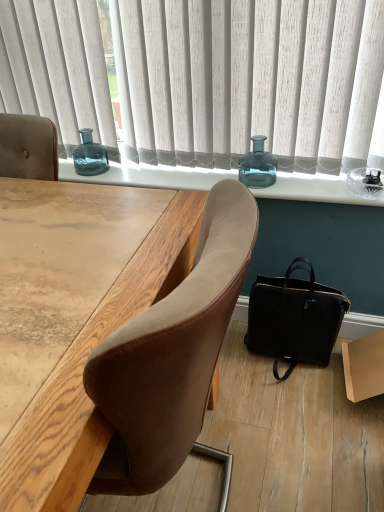
The width and height of the screenshot is (384, 512). I want to click on transparent glass vase at upper center, which is the 1th bottle from front to back, so (258, 165).

Between black leather handbag at lower right and wooden desk at center, which one appears on the right side from the viewer's perspective?

black leather handbag at lower right.

In the scene shown: Is black leather handbag at lower right located outside wooden desk at center?

Absolutely, black leather handbag at lower right is external to wooden desk at center.

Which of these two, black leather handbag at lower right or wooden desk at center, stands taller?

wooden desk at center is taller.

Is black leather handbag at lower right positioned with its back to wooden desk at center?

No, wooden desk at center is not at the back of black leather handbag at lower right.

From the picture: Is teal glass vase at center aimed at brown cardboard box at lower right?

No.

Between teal glass vase at center and brown cardboard box at lower right, which one is positioned in front?

brown cardboard box at lower right is closer to the camera.

From a real-world perspective, is teal glass vase at center physically located above or below brown cardboard box at lower right?

Clearly, from a real-world perspective, teal glass vase at center is above brown cardboard box at lower right.

At what (x,y) coordinates should I click in order to perform the action: click on box located underneath the teal glass vase at center (from a real-world perspective). Please return your answer as a coordinate pair (x, y). Looking at the image, I should click on (364, 366).

Can we say black leather handbag at lower right lies outside teal glass bottle at upper center, the first bottle viewed from the left?

Yes, black leather handbag at lower right is outside of teal glass bottle at upper center, the first bottle viewed from the left.

Which object is thinner, black leather handbag at lower right or teal glass bottle at upper center, arranged as the 2th bottle when viewed from the front?

teal glass bottle at upper center, arranged as the 2th bottle when viewed from the front.

Between black leather handbag at lower right and teal glass bottle at upper center, arranged as the 2th bottle when viewed from the front, which one has less height?

teal glass bottle at upper center, arranged as the 2th bottle when viewed from the front, is shorter.

From a real-world perspective, relative to teal glass bottle at upper center, arranged as the 2th bottle when viewed from the front, is black leather handbag at lower right vertically above or below?

In terms of real-world spatial position, black leather handbag at lower right is below teal glass bottle at upper center, arranged as the 2th bottle when viewed from the front.

From a real-world perspective, who is located lower, white fabric curtain at upper center or teal glass bottle at upper center, which is counted as the first bottle, starting from the back?

teal glass bottle at upper center, which is counted as the first bottle, starting from the back, from a real-world perspective.

Is white fabric curtain at upper center located outside teal glass bottle at upper center, arranged as the 2th bottle when viewed from the front?

Absolutely, white fabric curtain at upper center is external to teal glass bottle at upper center, arranged as the 2th bottle when viewed from the front.

Is white fabric curtain at upper center taller or shorter than teal glass bottle at upper center, the first bottle viewed from the left?

Considering their sizes, white fabric curtain at upper center has more height than teal glass bottle at upper center, the first bottle viewed from the left.

At what (x,y) coordinates should I click in order to perform the action: click on curtain on the left of black leather handbag at lower right. Please return your answer as a coordinate pair (x, y). Looking at the image, I should click on (251, 80).

Is black leather handbag at lower right at the back of white fabric curtain at upper center?

No, black leather handbag at lower right is not at the back of white fabric curtain at upper center.

Would you say white fabric curtain at upper center is a long distance from black leather handbag at lower right?

That's not correct — white fabric curtain at upper center is a little close to black leather handbag at lower right.

From a real-world perspective, does white fabric curtain at upper center sit lower than black leather handbag at lower right?

No, from a real-world perspective, white fabric curtain at upper center is not beneath black leather handbag at lower right.

Does point (98, 167) come closer to viewer compared to point (362, 339)?

No, (98, 167) is behind (362, 339).

In the scene shown: Does teal glass bottle at upper center, arranged as the 2th bottle when viewed from the front, have a greater height compared to brown cardboard box at lower right?

No.

Is teal glass bottle at upper center, which is counted as the first bottle, starting from the back, wider or thinner than brown cardboard box at lower right?

In the image, teal glass bottle at upper center, which is counted as the first bottle, starting from the back, appears to be more narrow than brown cardboard box at lower right.

Is the depth of teal glass bottle at upper center, the 2th bottle viewed from the right, less than that of brown cardboard box at lower right?

No, it is not.

Where is `desk on the left of white fabric curtain at upper center`? The width and height of the screenshot is (384, 512). desk on the left of white fabric curtain at upper center is located at coordinates (82, 375).

Looking at their sizes, would you say white fabric curtain at upper center is wider or thinner than wooden desk at center?

Clearly, white fabric curtain at upper center has less width compared to wooden desk at center.

Does white fabric curtain at upper center appear on the right side of wooden desk at center?

Indeed, white fabric curtain at upper center is positioned on the right side of wooden desk at center.

Are white fabric curtain at upper center and wooden desk at center making contact?

No, white fabric curtain at upper center is not next to wooden desk at center.

I want to click on handbag located underneath the wooden desk at center (from a real-world perspective), so click(294, 318).

This screenshot has width=384, height=512. What are the coordinates of `window sill on the left of brown cardboard box at lower right` in the screenshot? It's located at (149, 175).

Looking at the image, which one is located further to teal glass bottle at upper center, which is counted as the first bottle, starting from the back, wooden desk at center or white fabric curtain at upper center?

wooden desk at center is positioned further to the anchor teal glass bottle at upper center, which is counted as the first bottle, starting from the back.

When comparing their distances from teal glass bottle at upper center, the 2th bottle viewed from the right, does black leather handbag at lower right or brown cardboard box at lower right seem closer?

black leather handbag at lower right is closer to teal glass bottle at upper center, the 2th bottle viewed from the right.

When comparing their distances from teal glass vase at center, does white fabric curtain at upper center or teal glass bottle at upper center, arranged as the 2th bottle when viewed from the front, seem further?

teal glass bottle at upper center, arranged as the 2th bottle when viewed from the front, is further to teal glass vase at center.

Estimate the real-world distances between objects in this image. Which object is closer to transparent glass vase at upper center, the 2th bottle from the back, teal glass bottle at upper center, the first bottle viewed from the left, or white fabric curtain at upper center?

white fabric curtain at upper center is closer to transparent glass vase at upper center, the 2th bottle from the back.

Looking at the image, which one is located closer to brown cardboard box at lower right, teal glass vase at center or wooden desk at center?

teal glass vase at center lies closer to brown cardboard box at lower right than the other object.

Considering their positions, is wooden desk at center positioned further to teal glass vase at center than teal glass bottle at upper center, the first bottle viewed from the left?

wooden desk at center is further to teal glass vase at center.

From the image, which object appears to be farther from teal glass vase at center, transparent glass vase at upper center, which is counted as the 1th bottle, starting from the right, or black leather handbag at lower right?

black leather handbag at lower right.

Considering their positions, is teal glass vase at center positioned closer to white fabric curtain at upper center than transparent glass vase at upper center, which is the 1th bottle from front to back?

teal glass vase at center is positioned closer to the anchor white fabric curtain at upper center.

Locate an element on the screen. Image resolution: width=384 pixels, height=512 pixels. curtain positioned between wooden desk at center and teal glass bottle at upper center, which is counted as the first bottle, starting from the back, from near to far is located at coordinates pyautogui.click(x=251, y=80).

The height and width of the screenshot is (512, 384). Identify the location of window sill between white fabric curtain at upper center and black leather handbag at lower right in the vertical direction. (149, 175).

The width and height of the screenshot is (384, 512). I want to click on handbag between transparent glass vase at upper center, which is counted as the 1th bottle, starting from the right, and brown cardboard box at lower right in the up-down direction, so click(294, 318).

Locate an element on the screen. The height and width of the screenshot is (512, 384). curtain positioned between wooden desk at center and transparent glass vase at upper center, the 2th bottle from the back, from near to far is located at coordinates (251, 80).